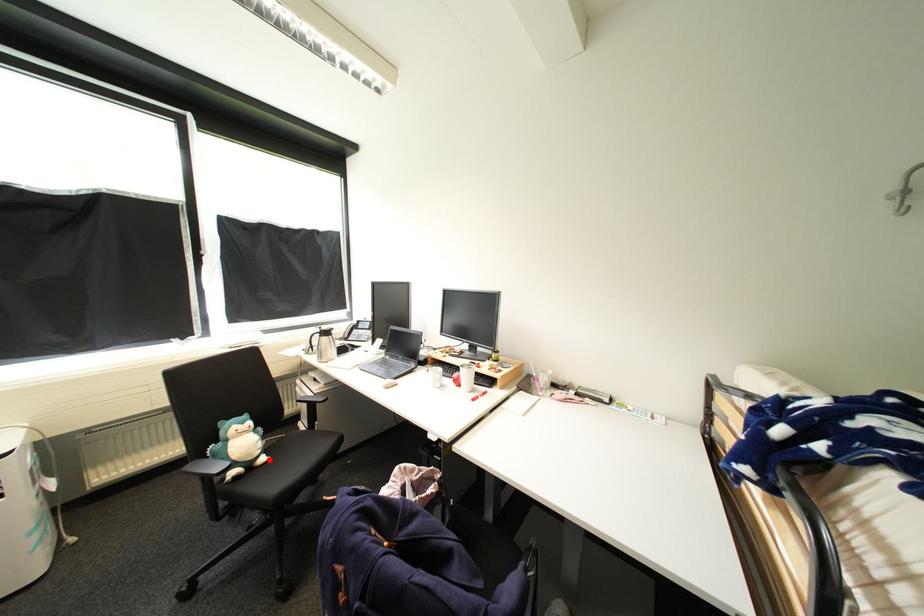
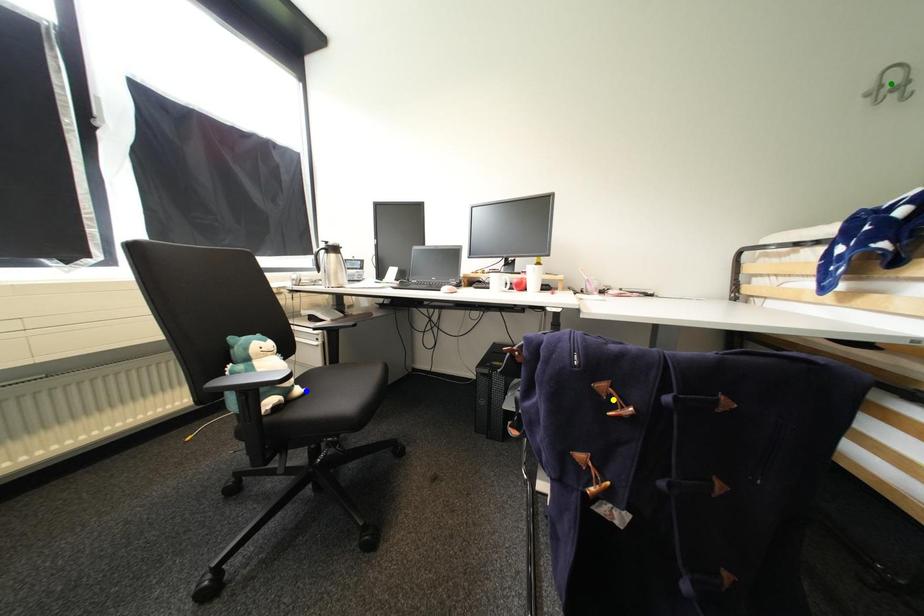
Question: I am providing you with two images of the same scene from different viewpoints. A red point is marked on the first image. You are given multiple points on the second image. Which point in image 2 is actually the same real-world point as the red point in image 1?

Choices:
 (A) green point
 (B) yellow point
 (C) blue point

Answer: (C)